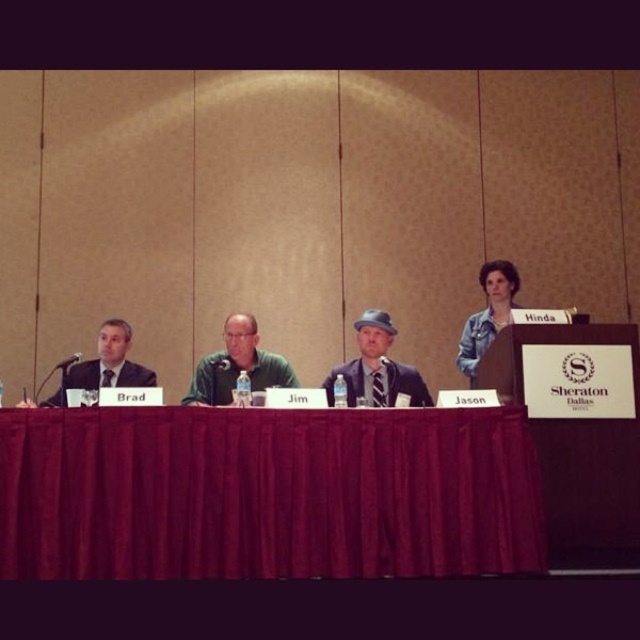
You are attending the panel discussion and notice the velvet red table at center and the blue jean jacket at upper right. From your perspective, which object is positioned to the left?

The velvet red table at center is to the left of the blue jean jacket at upper right.

You are attending the panel discussion and want to know which person is sitting in the center. Both the matte black suit at center and the matte black suit at left are present. Which one is taller?

The matte black suit at center is taller than the matte black suit at left.